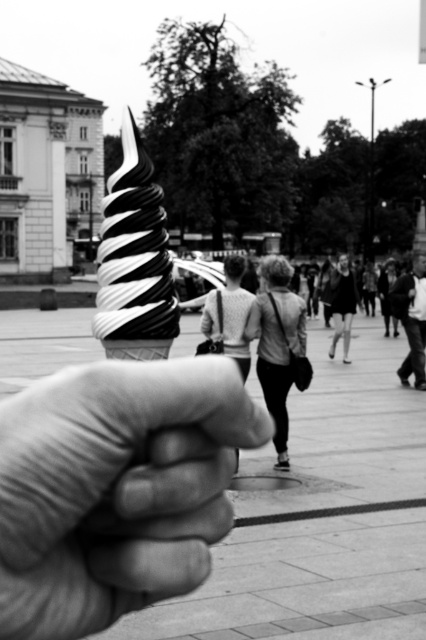
Is point (276, 403) closer to camera compared to point (347, 310)?

That is True.

I want to click on smooth gray jacket at center, so click(276, 342).

Does point (270, 333) lie behind point (334, 332)?

No, it is not.

Where is `smooth gray jacket at center`? This screenshot has width=426, height=640. smooth gray jacket at center is located at coordinates (276, 342).

Looking at this image, is black and white swirl ice cream at center positioned at the back of smooth gray jacket at center?

No, black and white swirl ice cream at center is in front of smooth gray jacket at center.

Between black and white swirl ice cream at center and smooth gray jacket at center, which one is positioned higher?

black and white swirl ice cream at center is above.

The image size is (426, 640). In order to click on black and white swirl ice cream at center in this screenshot , I will do `click(134, 260)`.

Between smooth skin hand at center and smooth gray jacket at center, which one has more height?

smooth gray jacket at center is taller.

Can you confirm if smooth skin hand at center is positioned above smooth gray jacket at center?

Actually, smooth skin hand at center is below smooth gray jacket at center.

Find the location of a particular element. The width and height of the screenshot is (426, 640). smooth skin hand at center is located at coordinates pyautogui.click(x=115, y=488).

The width and height of the screenshot is (426, 640). Identify the location of smooth skin hand at center. (115, 488).